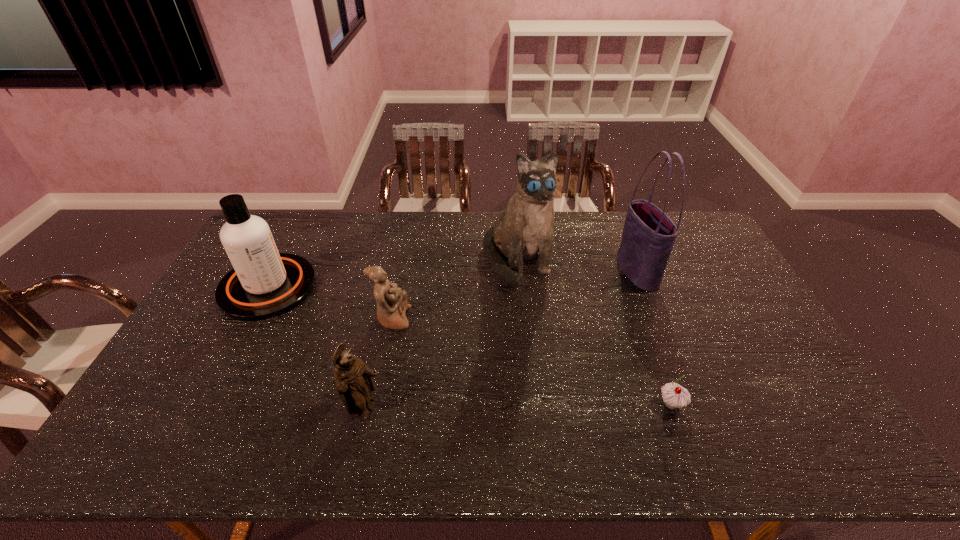
Identify the location of tote bag. This screenshot has height=540, width=960. (648, 237).

Locate an element on the screen. Image resolution: width=960 pixels, height=540 pixels. the third object from right to left is located at coordinates pos(523,232).

Where is `the leftmost object`? The height and width of the screenshot is (540, 960). the leftmost object is located at coordinates (263, 284).

Identify the location of cleansing agent. (263, 284).

Where is `the nearer figurine`? Image resolution: width=960 pixels, height=540 pixels. the nearer figurine is located at coordinates (353, 378).

At what (x,y) coordinates should I click in order to perform the action: click on the farther figurine. Please return your answer as a coordinate pair (x, y). Looking at the image, I should click on (391, 300).

I want to click on the shortest object, so click(x=675, y=396).

In order to click on vacant area situated on the back of the tote bag in this screenshot , I will do `click(623, 238)`.

This screenshot has width=960, height=540. I want to click on vacant region located at the face of the third object from right to left, so click(525, 335).

The width and height of the screenshot is (960, 540). In order to click on vacant region located 0.060m on the front of the fourth shortest object in this screenshot , I will do `click(242, 336)`.